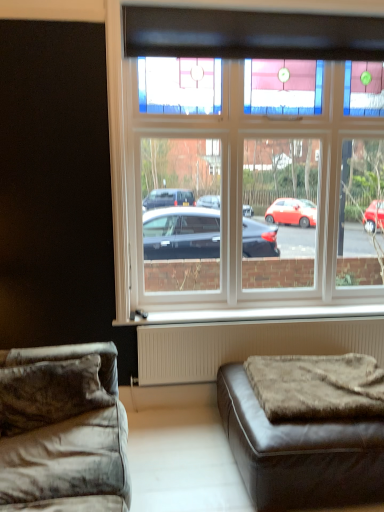
Locate an element on the screen. This screenshot has height=512, width=384. free spot below clear glass window at upper center (from a real-world perspective) is located at coordinates coord(299,310).